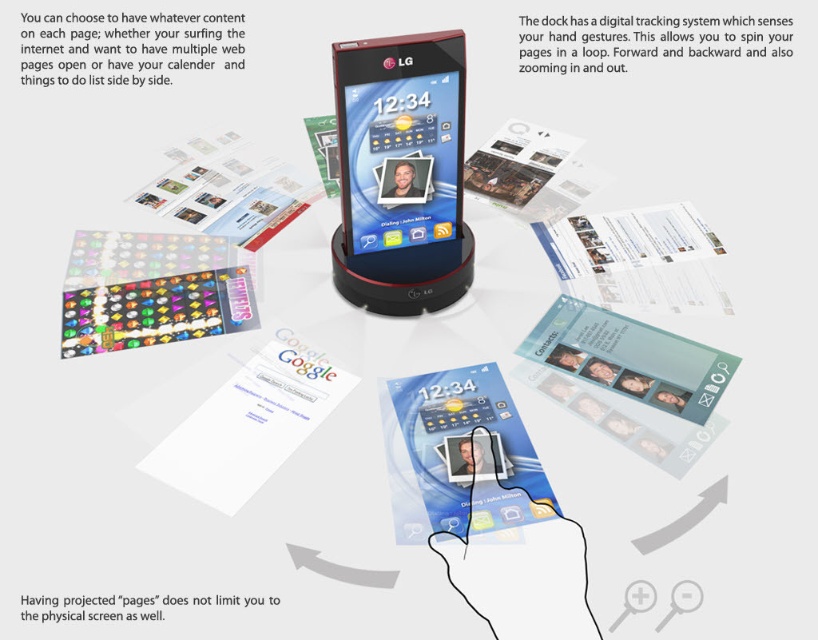
You are setting up a futuristic smartphone dock system. You have a matte black phone at center and a matte plastic card game at center. Which object is taller?

The matte black phone at center is taller than the matte plastic card game at center.

You are a user trying to locate the matte black phone at center in the futuristic smartphone dock system. According to the coordinate system where the bottom left corner is the origin, can you confirm if the point at coordinate (x=401, y=172) is the location of the matte black phone at center?

Yes, the point at coordinate (x=401, y=172) indicates the location of the matte black phone at center.

You are holding a matte black phone at center and want to place a matte plastic card game at center on the table. Can you place it in front of the phone without moving the phone?

The matte plastic card game at center is currently behind the matte black phone at center, so you can place it in front of the phone without moving it by positioning it in the available space in front of the phone.